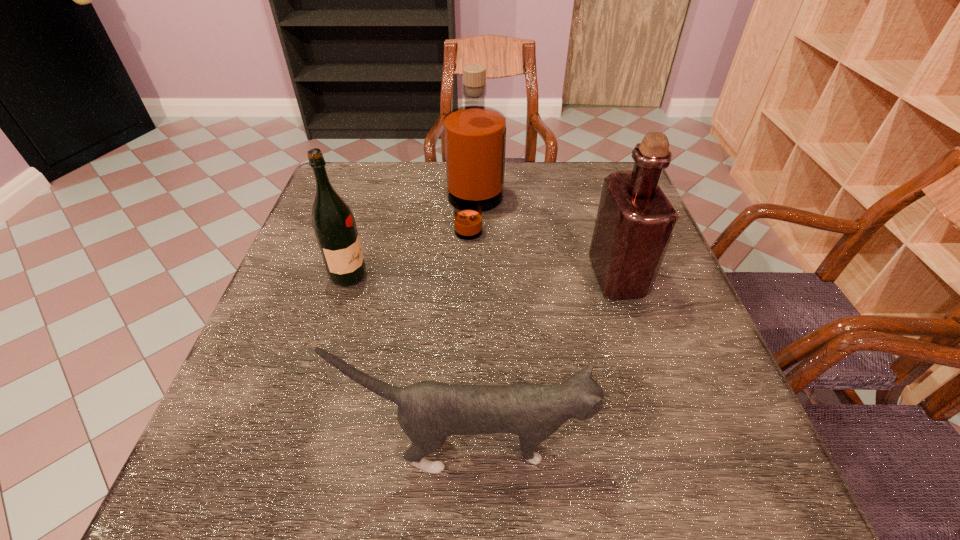
Where is `free spot that satisfies the following two spatial constraints: 1. on the front-facing side of the leftmost liquor; 2. on the left side of the rightmost object`? Image resolution: width=960 pixels, height=540 pixels. free spot that satisfies the following two spatial constraints: 1. on the front-facing side of the leftmost liquor; 2. on the left side of the rightmost object is located at coordinates (348, 277).

You are a GUI agent. You are given a task and a screenshot of the screen. Output one action in this format:
    pyautogui.click(x=<x>, y=<y>)
    Task: Click on the vacant area in the image that satisfies the following two spatial constraints: 1. on the back side of the rightmost liquor; 2. on the front-facing side of the leftmost liquor
    
    Given the screenshot: What is the action you would take?
    pyautogui.click(x=616, y=276)

Locate an element on the screen. The image size is (960, 540). vacant position in the image that satisfies the following two spatial constraints: 1. on the back side of the rightmost liquor; 2. on the front-facing side of the leftmost object is located at coordinates (616, 276).